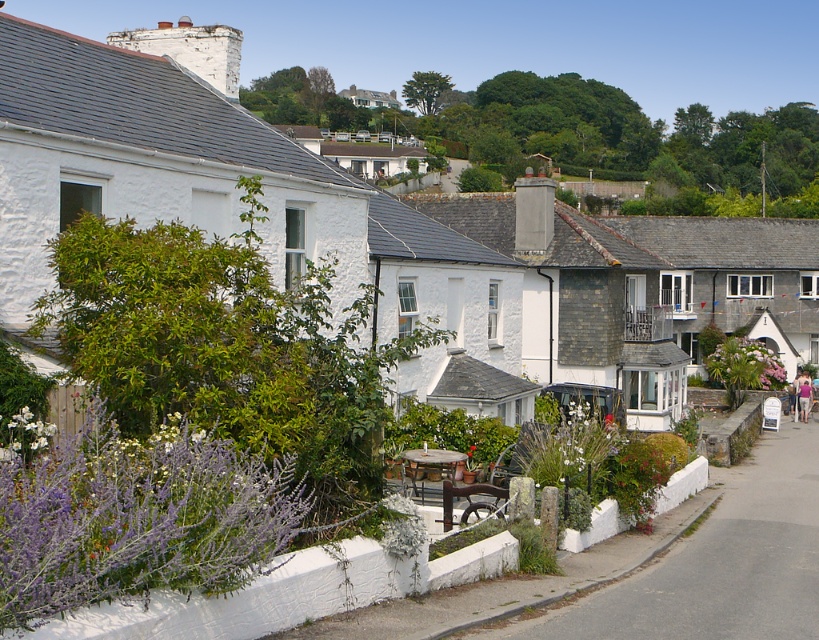
You are a delivery person carrying a package that requires a 5 meter clearance to pass through a narrow alley between the gray slate roofed cottage at center and the pink fabric at lower right. Can you safely navigate through this path with your package?

The distance between the gray slate roofed cottage at center and the pink fabric at lower right is 6.45 meters, which is more than the required 5 meter clearance. Therefore, you can safely navigate through the path with your package.

Looking at this image, you are standing at the center of the street looking towards the garden. Which direction should you walk to reach the white stucco cottage at upper left?

The white stucco cottage at upper left is located at point (152, 154), so you should walk towards the upper left direction to reach it.

You are standing on the street looking at the two cottages in the scene. Which cottage, the white stone cottage at center or the gray slate roofed cottage at center, appears closer to you?

The white stone cottage at center appears closer because it is positioned below the gray slate roofed cottage at center, indicating it is in a lower plane and thus nearer to the observer.